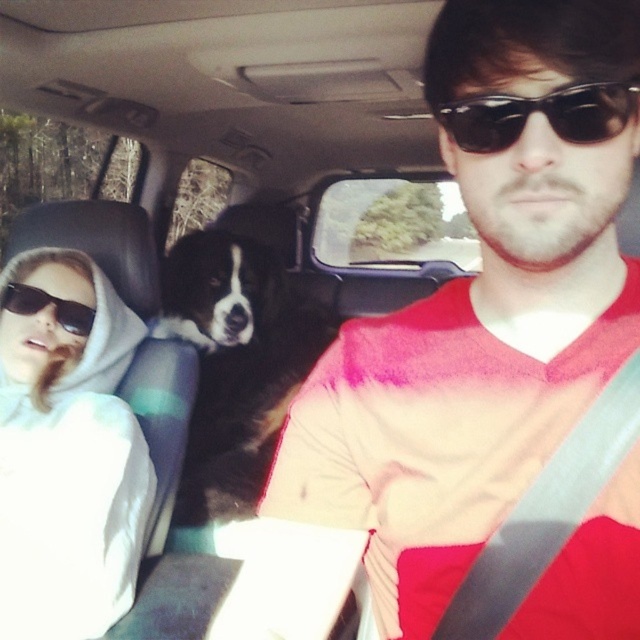
Question: Which object is closer to the camera taking this photo?

Choices:
 (A) white hoodie at left
 (B) black plastic sunglasses at upper center

Answer: (B)

Question: Considering the relative positions of black fur dog at center and black plastic sunglasses at upper left in the image provided, where is black fur dog at center located with respect to black plastic sunglasses at upper left?

Choices:
 (A) right
 (B) left

Answer: (A)

Question: Is white hoodie at left behind black plastic sunglasses at upper left?

Choices:
 (A) yes
 (B) no

Answer: (B)

Question: Which point is farther to the camera?

Choices:
 (A) white hoodie at left
 (B) black plastic sunglasses at upper left
 (C) black plastic sunglasses at upper center
 (D) black fur dog at center

Answer: (D)

Question: Is black plastic sunglasses at upper center to the left of black plastic sunglasses at upper left from the viewer's perspective?

Choices:
 (A) yes
 (B) no

Answer: (B)

Question: Which object is the farthest from the black fur dog at center?

Choices:
 (A) black plastic sunglasses at upper center
 (B) white hoodie at left
 (C) black plastic sunglasses at upper left

Answer: (A)